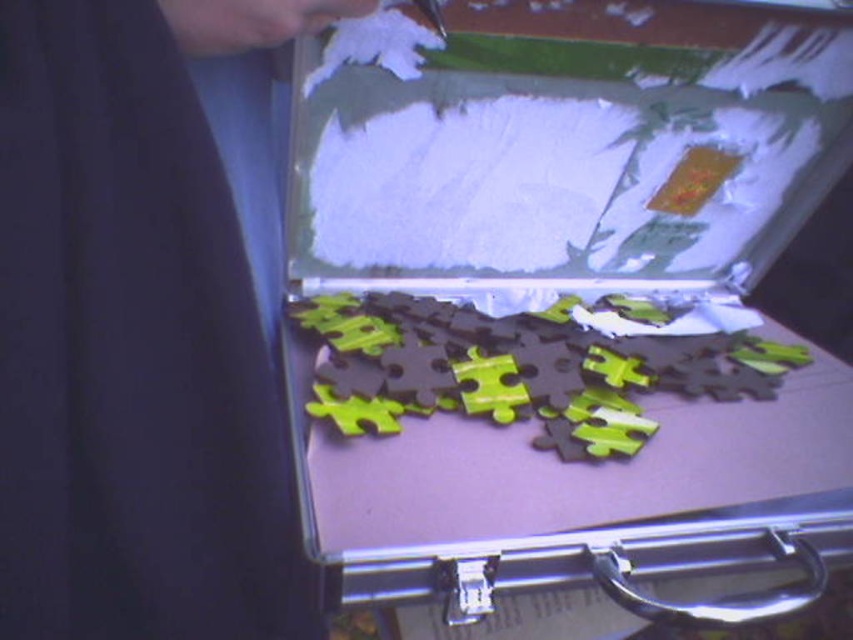
Consider the image. Between matte plastic puzzle pieces at center and dark fabric at upper left, which one is positioned higher?

Positioned higher is matte plastic puzzle pieces at center.

In the scene shown: Is matte plastic puzzle pieces at center shorter than dark fabric at upper left?

In fact, matte plastic puzzle pieces at center may be taller than dark fabric at upper left.

Who is more distant from viewer, (624, 470) or (177, 538)?

The point (624, 470) is behind.

This screenshot has width=853, height=640. Find the location of `matte plastic puzzle pieces at center`. matte plastic puzzle pieces at center is located at coordinates [x=561, y=301].

Between matte plastic puzzle pieces at center and matte green puzzle pieces at center, which one appears on the left side from the viewer's perspective?

Positioned to the left is matte green puzzle pieces at center.

Is matte plastic puzzle pieces at center bigger than matte green puzzle pieces at center?

Yes.

You are a GUI agent. You are given a task and a screenshot of the screen. Output one action in this format:
    pyautogui.click(x=<x>, y=<y>)
    Task: Click on the matte plastic puzzle pieces at center
    This screenshot has width=853, height=640.
    Given the screenshot: What is the action you would take?
    pyautogui.click(x=561, y=301)

Find the location of `matte plastic puzzle pieces at center`. matte plastic puzzle pieces at center is located at coordinates (561, 301).

Is dark fabric at upper left wider than matte green puzzle pieces at center?

Incorrect, dark fabric at upper left's width does not surpass matte green puzzle pieces at center's.

Does dark fabric at upper left have a larger size compared to matte green puzzle pieces at center?

Answer: Actually, dark fabric at upper left might be smaller than matte green puzzle pieces at center.

I want to click on dark fabric at upper left, so (x=134, y=336).

Identify the location of dark fabric at upper left. The image size is (853, 640). (134, 336).